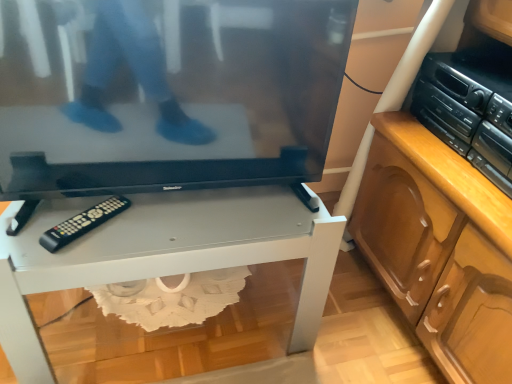
Question: Is black glossy television at center inside the boundaries of black plastic stereo at right, or outside?

Choices:
 (A) inside
 (B) outside

Answer: (B)

Question: Based on their sizes in the image, would you say black glossy television at center is bigger or smaller than black plastic stereo at right?

Choices:
 (A) small
 (B) big

Answer: (B)

Question: Estimate the real-world distances between objects in this image. Which object is farther from the white glossy desk at center?

Choices:
 (A) black plastic stereo at right
 (B) black plastic remote at lower left
 (C) black glossy television at center

Answer: (A)

Question: Which object is positioned closest to the black glossy television at center?

Choices:
 (A) white glossy desk at center
 (B) black plastic remote at lower left
 (C) black plastic stereo at right

Answer: (A)